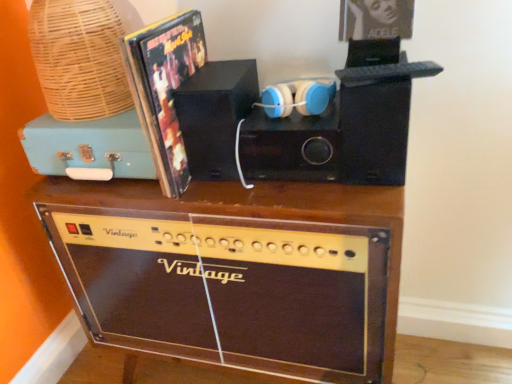
Question: From the image's perspective, is black matte speaker at center, which is the first speaker in left-to-right order, located above or below blue matte headphones at center?

Choices:
 (A) above
 (B) below

Answer: (B)

Question: Do you think black matte speaker at center, which is the first speaker in left-to-right order, is within blue matte headphones at center, or outside of it?

Choices:
 (A) outside
 (B) inside

Answer: (A)

Question: Based on their relative distances, which object is nearer to the blue matte headphones at center?

Choices:
 (A) woven bamboo basket at upper left
 (B) brown wood amplifier at lower center
 (C) shiny plastic album cover at upper left
 (D) black matte speaker at center, which is the first speaker in left-to-right order
 (E) black matte speaker at center, the first speaker when ordered from right to left

Answer: (E)

Question: Considering the real-world distances, which object is farthest from the black matte speaker at center, the first speaker when ordered from right to left?

Choices:
 (A) teal matte suitcase at upper left
 (B) blue matte headphones at center
 (C) black matte speaker at center, which is the first speaker in left-to-right order
 (D) brown wood amplifier at lower center
 (E) woven bamboo basket at upper left

Answer: (E)